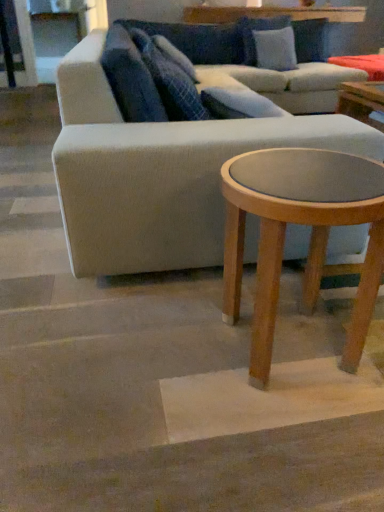
This screenshot has width=384, height=512. What are the coordinates of `vacant point to the left of light brown wood coffee table at lower right` in the screenshot? It's located at (148, 349).